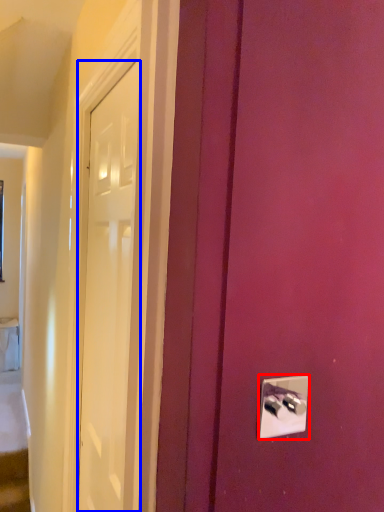
Question: Which object appears farthest to the camera in this image, light switch (highlighted by a red box) or door (highlighted by a blue box)?

Choices:
 (A) light switch
 (B) door

Answer: (B)